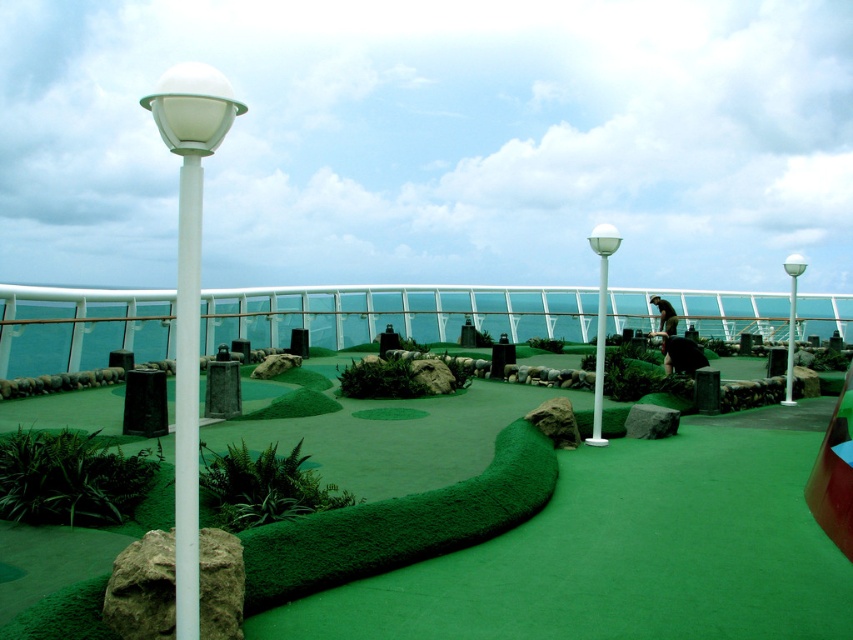
Who is positioned more to the left, white plastic pole at left or white plastic lamp post at right?

white plastic pole at left

Can you confirm if white plastic pole at left is positioned above white plastic lamp post at right?

Indeed, white plastic pole at left is positioned over white plastic lamp post at right.

Between point (184, 339) and point (793, 337), which one is positioned in front?

Point (184, 339) is in front.

You are a GUI agent. You are given a task and a screenshot of the screen. Output one action in this format:
    pyautogui.click(x=<x>, y=<y>)
    Task: Click on the white plastic pole at left
    The height and width of the screenshot is (640, 853).
    Given the screenshot: What is the action you would take?
    pyautogui.click(x=187, y=400)

Between point (607, 240) and point (787, 266), which one is positioned behind?

The point (787, 266) is behind.

Measure the distance between point (604, 292) and camera.

They are 9.12 meters apart.

Is point (611, 237) farther from camera compared to point (788, 312)?

No, it is in front of (788, 312).

Locate an element on the screen. The width and height of the screenshot is (853, 640). white glossy lamp post at center is located at coordinates (601, 320).

Can you confirm if green artificial turf at center is smaller than white plastic lamp post at right?

Yes, green artificial turf at center is smaller than white plastic lamp post at right.

Which is in front, point (787, 538) or point (790, 332)?

Positioned in front is point (787, 538).

At what (x,y) coordinates should I click in order to perform the action: click on green artificial turf at center. Please return your answer as a coordinate pair (x, y). Image resolution: width=853 pixels, height=640 pixels. Looking at the image, I should click on (624, 552).